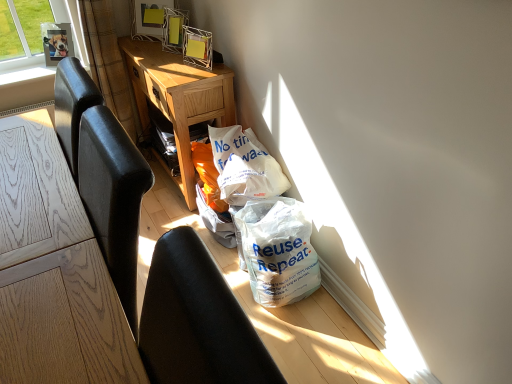
Question: Is white plastic bag at lower right positioned with its back to light oak desk at center?

Choices:
 (A) no
 (B) yes

Answer: (A)

Question: Is white plastic bag at lower right aimed at light oak desk at center?

Choices:
 (A) no
 (B) yes

Answer: (A)

Question: Does white plastic bag at lower right have a larger size compared to light oak desk at center?

Choices:
 (A) yes
 (B) no

Answer: (B)

Question: From the image's perspective, is white plastic bag at lower right on top of light oak desk at center?

Choices:
 (A) no
 (B) yes

Answer: (A)

Question: Is the position of white plastic bag at lower right less distant than that of light oak desk at center?

Choices:
 (A) yes
 (B) no

Answer: (A)

Question: In terms of height, does white plastic bag at lower right look taller or shorter compared to light oak desk at center?

Choices:
 (A) short
 (B) tall

Answer: (A)

Question: Considering the relative positions of white plastic bag at lower right and light oak desk at center in the image provided, is white plastic bag at lower right to the left or to the right of light oak desk at center?

Choices:
 (A) left
 (B) right

Answer: (B)

Question: Which is correct: white plastic bag at lower right is inside light oak desk at center, or outside of it?

Choices:
 (A) inside
 (B) outside

Answer: (B)

Question: Considering the positions of point (295, 279) and point (231, 117), is point (295, 279) closer or farther from the camera than point (231, 117)?

Choices:
 (A) farther
 (B) closer

Answer: (B)

Question: In the image, is white plastic bag at lower right positioned in front of or behind white plastic bag at center?

Choices:
 (A) front
 (B) behind

Answer: (A)

Question: Is white plastic bag at lower right bigger or smaller than white plastic bag at center?

Choices:
 (A) big
 (B) small

Answer: (A)

Question: In the image, is white plastic bag at lower right on the left side or the right side of white plastic bag at center?

Choices:
 (A) right
 (B) left

Answer: (A)

Question: Does point (301, 236) appear closer or farther from the camera than point (246, 175)?

Choices:
 (A) closer
 (B) farther

Answer: (A)

Question: From a real-world perspective, is metallic silver picture frame at upper center, the first picture frame from the right, positioned above or below brown textured curtain at upper left?

Choices:
 (A) above
 (B) below

Answer: (A)

Question: Looking at their shapes, would you say metallic silver picture frame at upper center, the first picture frame from the right, is wider or thinner than brown textured curtain at upper left?

Choices:
 (A) thin
 (B) wide

Answer: (A)